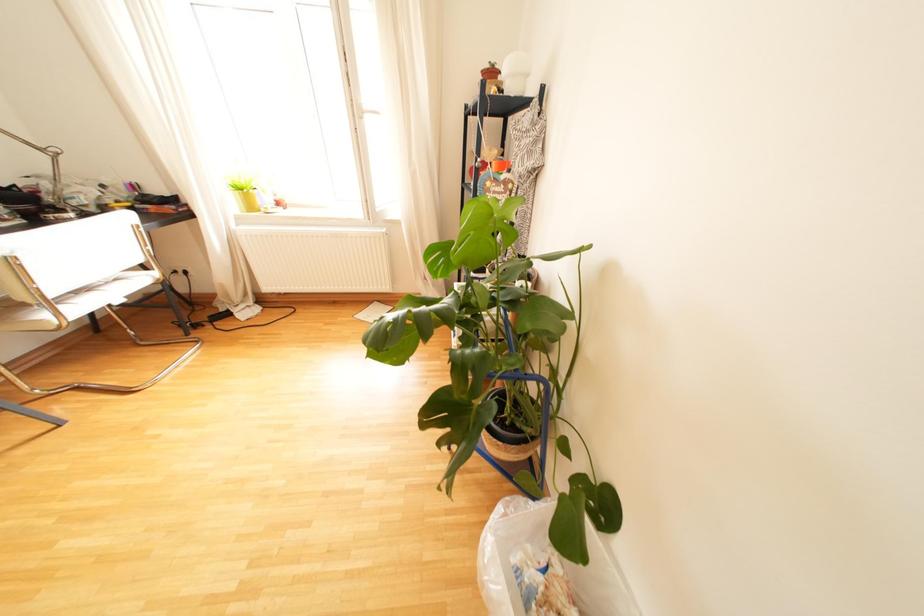
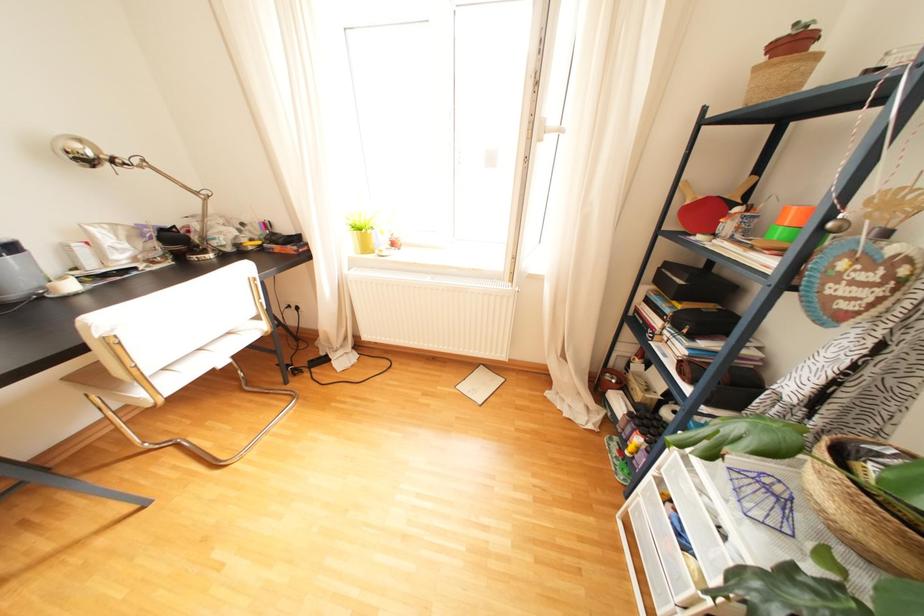
Which direction would the cameraman need to move to produce the second image?

The cameraman moved toward left, forward.